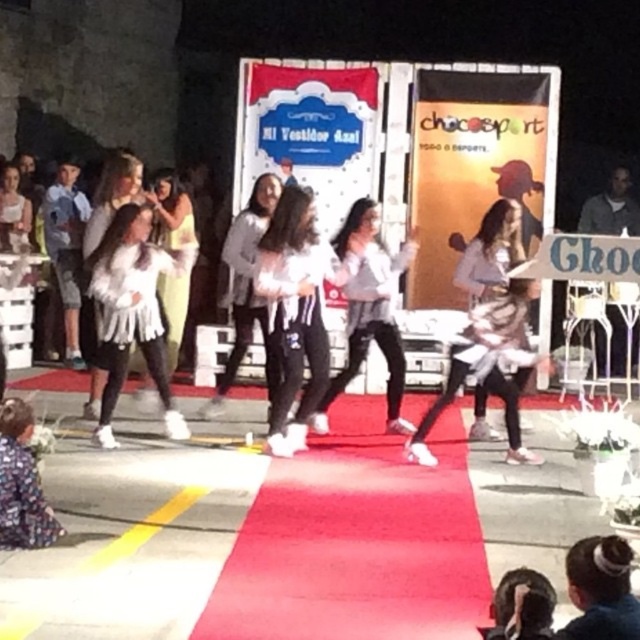
Question: Is white fluffy dress at center above white textured dress at center?

Choices:
 (A) yes
 (B) no

Answer: (A)

Question: Which point appears farthest from the camera in this image?

Choices:
 (A) (172, 349)
 (B) (493, 236)
 (C) (387, 252)
 (D) (138, 163)

Answer: (A)

Question: Which of the following is the closest to the observer?

Choices:
 (A) white fluffy coat at center
 (B) white fuzzy coat at center

Answer: (B)

Question: Which point is farther from the camera taking this photo?

Choices:
 (A) (280, 260)
 (B) (124, 289)
 (C) (92, 417)
 (D) (342, 365)

Answer: (D)

Question: Is white matte pants at center to the right of white fuzzy coat at center from the viewer's perspective?

Choices:
 (A) no
 (B) yes

Answer: (B)

Question: Can you confirm if white matte pants at center is wider than white fluffy coat at center?

Choices:
 (A) no
 (B) yes

Answer: (B)